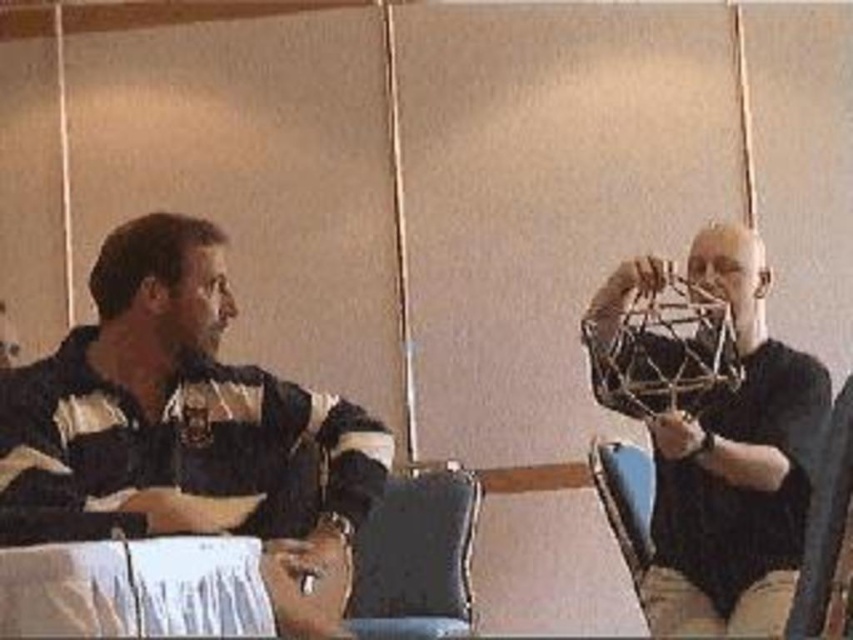
Question: Does striped jersey shirt at left appear over dark gray fabric chair at lower center?

Choices:
 (A) no
 (B) yes

Answer: (B)

Question: Which point is farther to the camera?

Choices:
 (A) striped jersey shirt at left
 (B) metallic gold geometric structure at right

Answer: (B)

Question: Does metallic gold geometric structure at right have a smaller size compared to dark gray fabric chair at lower center?

Choices:
 (A) no
 (B) yes

Answer: (A)

Question: Which object is the closest to the metallic gold geometric structure at right?

Choices:
 (A) striped jersey shirt at left
 (B) dark gray fabric chair at lower center

Answer: (A)

Question: Which object is closer to the camera taking this photo?

Choices:
 (A) striped jersey shirt at left
 (B) metallic gold geometric structure at right

Answer: (A)

Question: Is striped jersey shirt at left to the right of metallic gold geometric structure at right from the viewer's perspective?

Choices:
 (A) yes
 (B) no

Answer: (B)